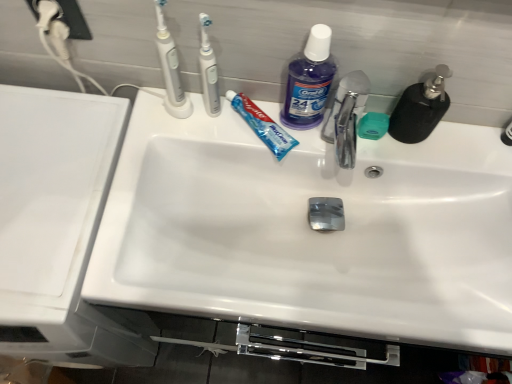
At what (x,y) coordinates should I click in order to perform the action: click on vacant space in front of white plastic toothbrush at upper left, placed as the 1th toothbrush when sorted from left to right. Please return your answer as a coordinate pair (x, y). Image resolution: width=512 pixels, height=384 pixels. Looking at the image, I should click on (160, 140).